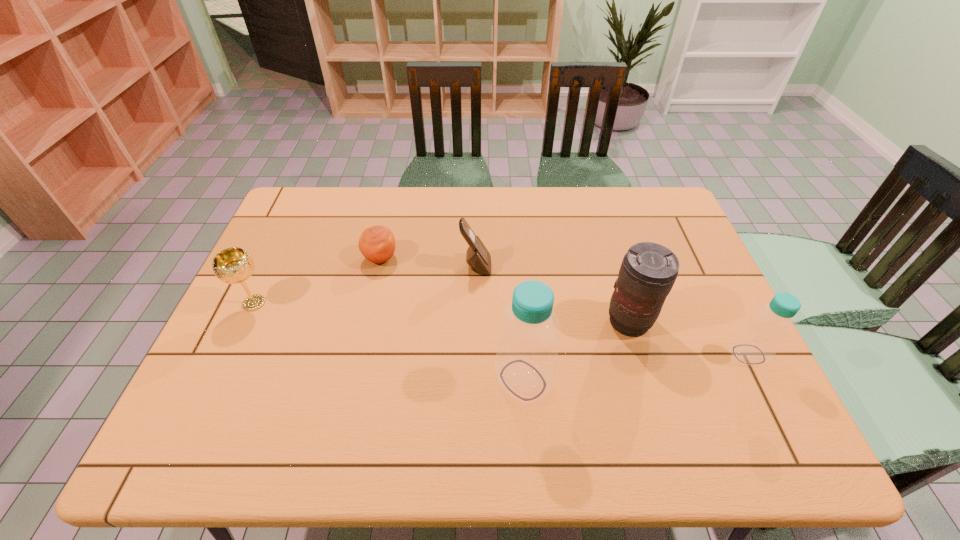
Find the location of a particular element. This screenshot has height=540, width=960. free space located 0.400m on the back of the rightmost object is located at coordinates (690, 237).

The image size is (960, 540). I want to click on vacant space situated 0.090m on the front of the orange, so click(x=372, y=294).

At what (x,y) coordinates should I click in order to perform the action: click on blank space located 0.210m on the right of the leftmost object. Please return your answer as a coordinate pair (x, y). This screenshot has height=540, width=960. Looking at the image, I should click on (348, 303).

Identify the location of vacant point located 0.270m on the front-facing side of the cellular telephone. The image size is (960, 540). (584, 266).

I want to click on free space located on the side of the telephoto lens where the control switches are located, so [x=641, y=362].

Identify the location of object positioned at the near edge. (526, 361).

At what (x,y) coordinates should I click in order to perform the action: click on object present at the left edge. Please return your answer as a coordinate pair (x, y). The width and height of the screenshot is (960, 540). Looking at the image, I should click on (234, 265).

At what (x,y) coordinates should I click in order to perform the action: click on object that is at the right edge. Please return your answer as a coordinate pair (x, y). The width and height of the screenshot is (960, 540). Looking at the image, I should click on (757, 342).

I want to click on vacant space at the far edge of the desktop, so click(x=496, y=226).

Locate an element on the screen. Image resolution: width=960 pixels, height=540 pixels. blank space at the near edge of the desktop is located at coordinates (277, 384).